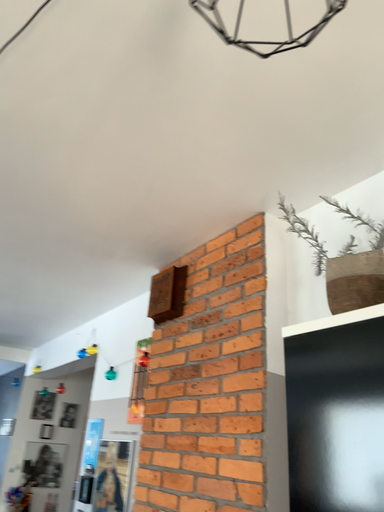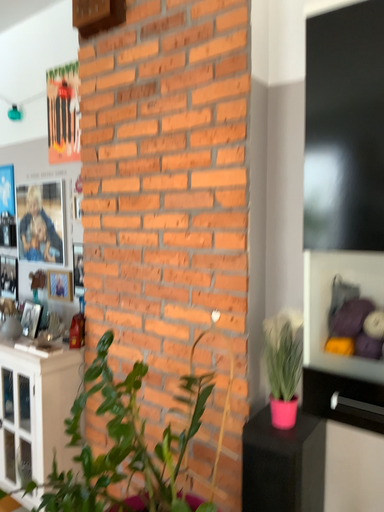
Question: Which way did the camera rotate in the video?

Choices:
 (A) rotated upward
 (B) rotated downward

Answer: (B)